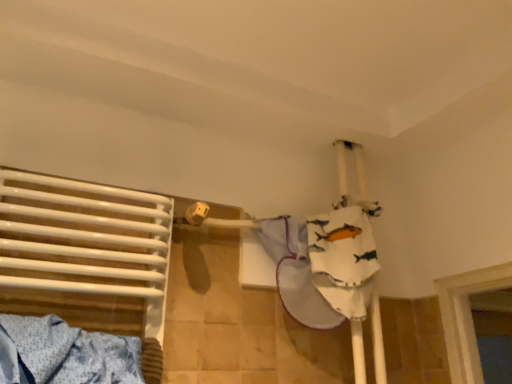
Question: Considering the positions of white cotton cloth at upper right and white glossy towel at left in the image, is white cotton cloth at upper right wider or thinner than white glossy towel at left?

Choices:
 (A) thin
 (B) wide

Answer: (B)

Question: Considering the positions of white cotton cloth at upper right and white glossy towel at left in the image, is white cotton cloth at upper right bigger or smaller than white glossy towel at left?

Choices:
 (A) small
 (B) big

Answer: (A)

Question: From their relative heights in the image, would you say white cotton cloth at upper right is taller or shorter than white glossy towel at left?

Choices:
 (A) tall
 (B) short

Answer: (B)

Question: Is white glossy towel at left wider or thinner than white cotton cloth at upper right?

Choices:
 (A) thin
 (B) wide

Answer: (A)

Question: Relative to white cotton cloth at upper right, is white glossy towel at left in front or behind?

Choices:
 (A) behind
 (B) front

Answer: (B)

Question: Is white glossy towel at left spatially inside white cotton cloth at upper right, or outside of it?

Choices:
 (A) outside
 (B) inside

Answer: (A)

Question: From a real-world perspective, is white glossy towel at left above or below white cotton cloth at upper right?

Choices:
 (A) below
 (B) above

Answer: (A)